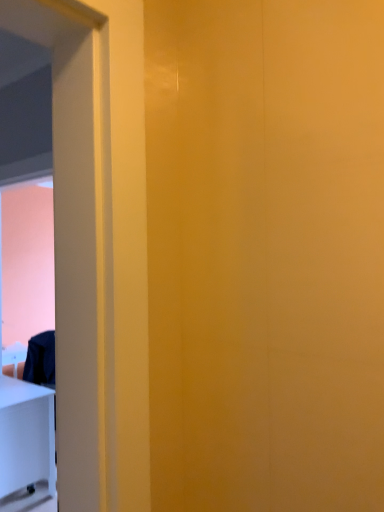
At what (x,y) coordinates should I click in order to perform the action: click on white glossy table at lower left. Please return your answer as a coordinate pair (x, y). Looking at the image, I should click on (26, 436).

What do you see at coordinates (26, 436) in the screenshot? I see `white glossy table at lower left` at bounding box center [26, 436].

Image resolution: width=384 pixels, height=512 pixels. In order to click on white glossy screen door at left in this screenshot , I will do `click(70, 227)`.

Describe the element at coordinates (70, 227) in the screenshot. I see `white glossy screen door at left` at that location.

Image resolution: width=384 pixels, height=512 pixels. I want to click on white glossy table at lower left, so click(26, 436).

Can you confirm if white glossy screen door at left is positioned to the left of white glossy table at lower left?

Incorrect, white glossy screen door at left is not on the left side of white glossy table at lower left.

In the scene shown: Who is more distant, white glossy screen door at left or white glossy table at lower left?

white glossy table at lower left is behind.

Does point (46, 467) lie in front of point (19, 399)?

No, it is not.

From the image's perspective, which is above, white glossy screen door at left or white glossy table at lower left?

white glossy screen door at left is shown above in the image.

From a real-world perspective, which is physically above, white glossy screen door at left or white glossy table at lower left?

white glossy screen door at left.

Between white glossy screen door at left and white glossy table at lower left, which one has smaller width?

white glossy screen door at left is thinner.

Considering the sizes of objects white glossy screen door at left and white glossy table at lower left in the image provided, who is shorter, white glossy screen door at left or white glossy table at lower left?

white glossy table at lower left is shorter.

Can you confirm if white glossy screen door at left is smaller than white glossy table at lower left?

Actually, white glossy screen door at left might be larger than white glossy table at lower left.

Does white glossy screen door at left contain white glossy table at lower left?

Actually, white glossy table at lower left is outside white glossy screen door at left.

Based on the photo, are white glossy screen door at left and white glossy table at lower left located far from each other?

white glossy screen door at left is near white glossy table at lower left, not far away.

Does white glossy screen door at left turn towards white glossy table at lower left?

No, white glossy screen door at left is not aimed at white glossy table at lower left.

The image size is (384, 512). In order to click on furniture that is behind the white glossy screen door at left in this screenshot , I will do `click(26, 436)`.

Can you confirm if white glossy table at lower left is positioned to the left of white glossy screen door at left?

Correct, you'll find white glossy table at lower left to the left of white glossy screen door at left.

Between white glossy table at lower left and white glossy screen door at left, which one is positioned behind?

white glossy table at lower left is more distant.

Does point (46, 460) appear closer or farther from the camera than point (14, 36)?

Point (46, 460) is positioned farther from the camera compared to point (14, 36).

Looking at this image, from the image's perspective, relative to white glossy screen door at left, is white glossy table at lower left above or below?

From the image's perspective, white glossy table at lower left appears below white glossy screen door at left.

From a real-world perspective, between white glossy table at lower left and white glossy screen door at left, who is vertically lower?

From a 3D spatial view, white glossy table at lower left is below.

From the picture: Is white glossy table at lower left thinner than white glossy screen door at left?

In fact, white glossy table at lower left might be wider than white glossy screen door at left.

Can you confirm if white glossy table at lower left is taller than white glossy screen door at left?

In fact, white glossy table at lower left may be shorter than white glossy screen door at left.

Considering the sizes of objects white glossy table at lower left and white glossy screen door at left in the image provided, who is smaller, white glossy table at lower left or white glossy screen door at left?

white glossy table at lower left.

Would you say white glossy table at lower left is outside white glossy screen door at left?

Answer: Indeed, white glossy table at lower left is completely outside white glossy screen door at left.

Is white glossy table at lower left far away from white glossy screen door at left?

white glossy table at lower left is actually quite close to white glossy screen door at left.

Is white glossy table at lower left positioned with its back to white glossy screen door at left?

No, white glossy table at lower left is not facing away from white glossy screen door at left.

What's the angular difference between white glossy table at lower left and white glossy screen door at left's facing directions?

They differ by 178 degrees in their facing directions.

How distant is white glossy table at lower left from white glossy screen door at left?

white glossy table at lower left and white glossy screen door at left are 3.59 centimeters apart from each other.

Find the location of a particular element. furniture behind the white glossy screen door at left is located at coordinates (26, 436).

You are a GUI agent. You are given a task and a screenshot of the screen. Output one action in this format:
    pyautogui.click(x=<x>, y=<y>)
    Task: Click on the furniture below the white glossy screen door at left (from a real-world perspective)
    The height and width of the screenshot is (512, 384).
    Given the screenshot: What is the action you would take?
    tap(26, 436)

Locate an element on the screen. screen door to the right of white glossy table at lower left is located at coordinates (70, 227).